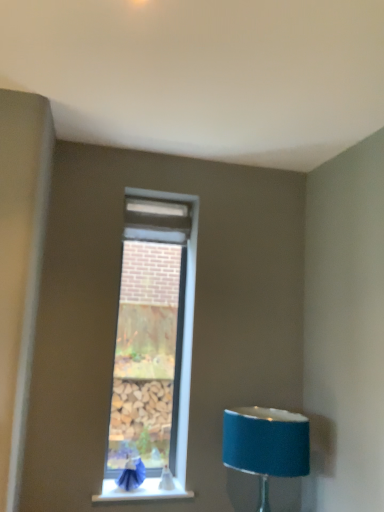
Measure the distance between blue fabric lampshade at lower right and camera.

blue fabric lampshade at lower right is 2.12 meters away from camera.

Locate an element on the screen. The width and height of the screenshot is (384, 512). blue fabric lampshade at lower right is located at coordinates (266, 445).

Consider the image. Could you tell me if white smooth window sill at lower center is facing blue fabric swivel chair at lower left?

Yes, white smooth window sill at lower center faces towards blue fabric swivel chair at lower left.

Is white smooth window sill at lower center to the left of blue fabric swivel chair at lower left from the viewer's perspective?

In fact, white smooth window sill at lower center is to the right of blue fabric swivel chair at lower left.

Is white smooth window sill at lower center wider or thinner than blue fabric swivel chair at lower left?

Clearly, white smooth window sill at lower center has more width compared to blue fabric swivel chair at lower left.

From the image's perspective, which one is positioned higher, white smooth window sill at lower center or blue fabric swivel chair at lower left?

From the image's view, blue fabric swivel chair at lower left is above.

Considering the sizes of blue fabric swivel chair at lower left and white smooth window sill at lower center in the image, is blue fabric swivel chair at lower left wider or thinner than white smooth window sill at lower center?

blue fabric swivel chair at lower left is thinner than white smooth window sill at lower center.

In the scene shown: Considering the sizes of objects blue fabric swivel chair at lower left and white smooth window sill at lower center in the image provided, who is bigger, blue fabric swivel chair at lower left or white smooth window sill at lower center?

With larger size is blue fabric swivel chair at lower left.

From a real-world perspective, relative to white smooth window sill at lower center, is blue fabric swivel chair at lower left vertically above or below?

In terms of real-world spatial position, blue fabric swivel chair at lower left is above white smooth window sill at lower center.

Is blue fabric lampshade at lower right next to white smooth window sill at lower center and touching it?

No.

Which point is more distant from viewer, (246, 421) or (146, 478)?

Point (146, 478)

Is white smooth window sill at lower center a part of blue fabric lampshade at lower right?

No, white smooth window sill at lower center is not a part of blue fabric lampshade at lower right.

In order to click on swivel chair below the blue fabric lampshade at lower right (from a real-world perspective) in this screenshot , I will do pos(132,474).

How distant is blue fabric swivel chair at lower left from blue fabric lampshade at lower right?

blue fabric swivel chair at lower left is 27.04 inches away from blue fabric lampshade at lower right.

From a real-world perspective, is blue fabric swivel chair at lower left on blue fabric lampshade at lower right?

No.

Is blue fabric swivel chair at lower left situated inside blue fabric lampshade at lower right or outside?

blue fabric swivel chair at lower left cannot be found inside blue fabric lampshade at lower right.

Who is shorter, blue fabric lampshade at lower right or blue fabric swivel chair at lower left?

Standing shorter between the two is blue fabric swivel chair at lower left.

Could you tell me if blue fabric lampshade at lower right is turned towards blue fabric swivel chair at lower left?

No, blue fabric lampshade at lower right does not turn towards blue fabric swivel chair at lower left.

Where is `lamp above the blue fabric swivel chair at lower left (from a real-world perspective)`? This screenshot has height=512, width=384. lamp above the blue fabric swivel chair at lower left (from a real-world perspective) is located at coordinates (266, 445).

Considering the relative sizes of blue fabric lampshade at lower right and blue fabric swivel chair at lower left in the image provided, is blue fabric lampshade at lower right thinner than blue fabric swivel chair at lower left?

No.

Considering the relative positions of white smooth window sill at lower center and blue fabric lampshade at lower right in the image provided, is white smooth window sill at lower center to the left or to the right of blue fabric lampshade at lower right?

From the image, it's evident that white smooth window sill at lower center is to the left of blue fabric lampshade at lower right.

Which is in front, white smooth window sill at lower center or blue fabric lampshade at lower right?

Positioned in front is blue fabric lampshade at lower right.

Can you confirm if white smooth window sill at lower center is taller than blue fabric lampshade at lower right?

No.

The image size is (384, 512). Find the location of `window sill beneath the blue fabric swivel chair at lower left (from a real-world perspective)`. window sill beneath the blue fabric swivel chair at lower left (from a real-world perspective) is located at coordinates (141, 492).

Find the location of a particular element. The image size is (384, 512). window sill below the blue fabric swivel chair at lower left (from the image's perspective) is located at coordinates (141, 492).

Looking at the image, which one is located further to blue fabric lampshade at lower right, blue fabric swivel chair at lower left or white smooth window sill at lower center?

blue fabric swivel chair at lower left.

When comparing their distances from white smooth window sill at lower center, does blue fabric swivel chair at lower left or blue fabric lampshade at lower right seem further?

blue fabric lampshade at lower right lies further to white smooth window sill at lower center than the other object.

Looking at the image, which one is located closer to blue fabric swivel chair at lower left, white smooth window sill at lower center or blue fabric lampshade at lower right?

The object closer to blue fabric swivel chair at lower left is white smooth window sill at lower center.

When comparing their distances from blue fabric swivel chair at lower left, does blue fabric lampshade at lower right or white smooth window sill at lower center seem closer?

Based on the image, white smooth window sill at lower center appears to be nearer to blue fabric swivel chair at lower left.

Looking at the image, which one is located closer to white smooth window sill at lower center, blue fabric lampshade at lower right or blue fabric swivel chair at lower left?

blue fabric swivel chair at lower left lies closer to white smooth window sill at lower center than the other object.

When comparing their distances from blue fabric lampshade at lower right, does white smooth window sill at lower center or blue fabric swivel chair at lower left seem closer?

The object closer to blue fabric lampshade at lower right is white smooth window sill at lower center.

Where is `window sill between blue fabric swivel chair at lower left and blue fabric lampshade at lower right from left to right`? This screenshot has width=384, height=512. window sill between blue fabric swivel chair at lower left and blue fabric lampshade at lower right from left to right is located at coordinates (141, 492).